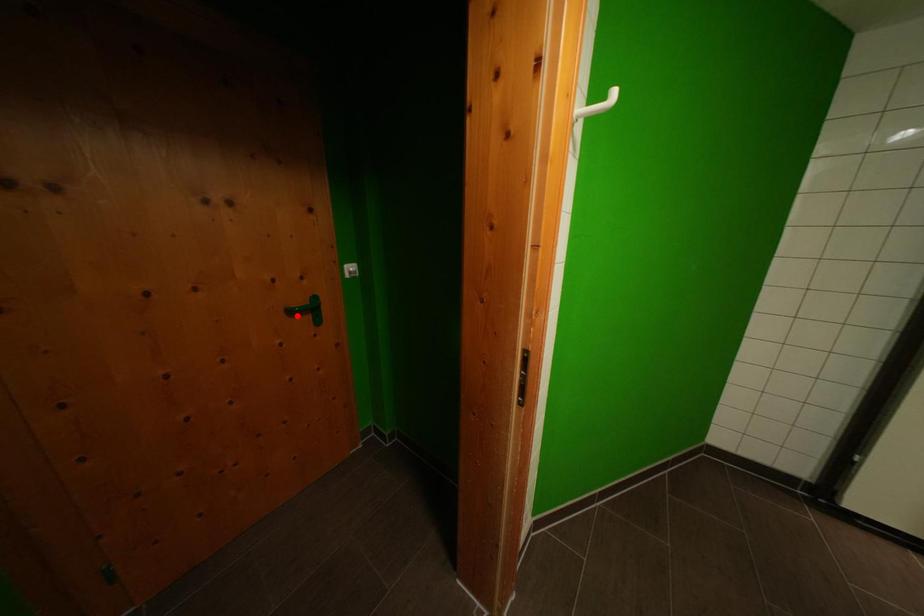
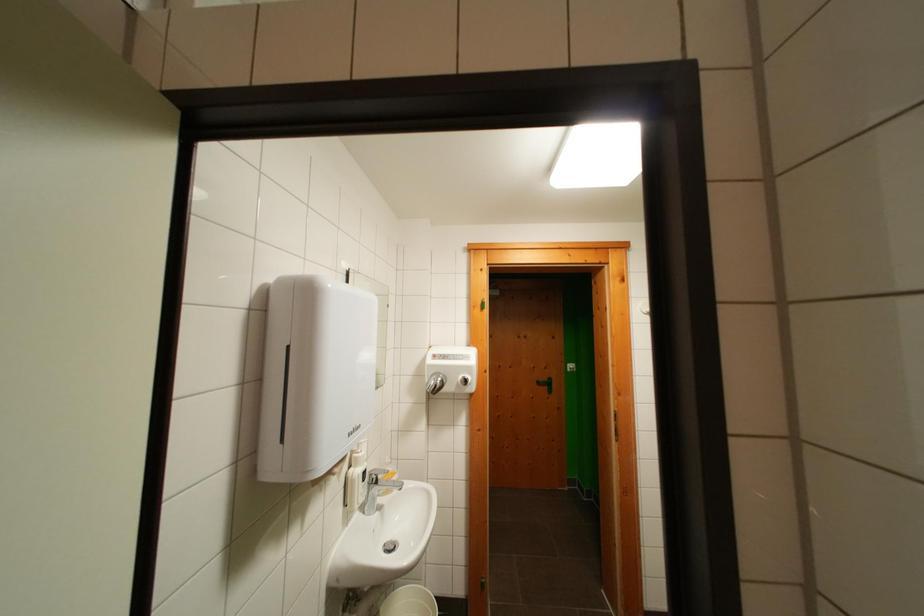
Question: I am providing you with two images of the same scene from different viewpoints. A red point is shown in image1. For the corresponding object point in image2, is it positioned nearer or farther from the camera?

Choices:
 (A) Nearer
 (B) Farther

Answer: (B)